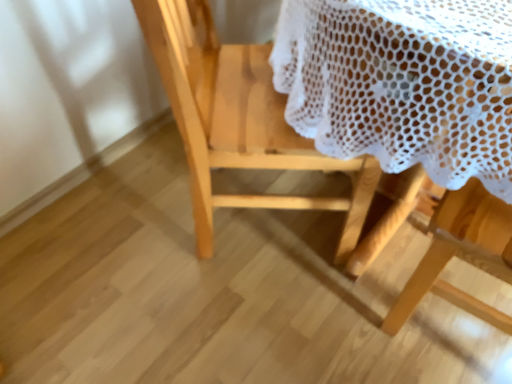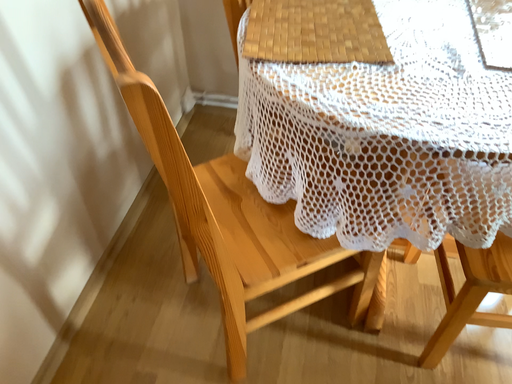
Question: How did the camera likely rotate when shooting the video?

Choices:
 (A) rotated downward
 (B) rotated upward

Answer: (B)